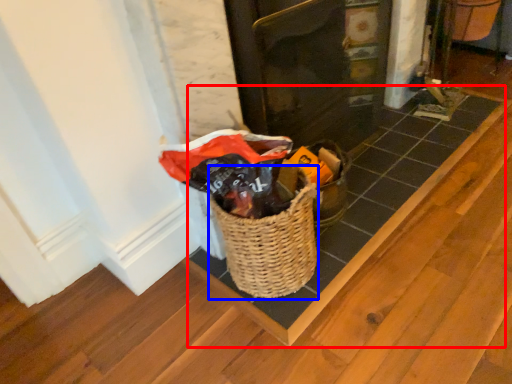
Question: Which object appears farthest to the camera in this image, plank (highlighted by a red box) or basket (highlighted by a blue box)?

Choices:
 (A) plank
 (B) basket

Answer: (A)